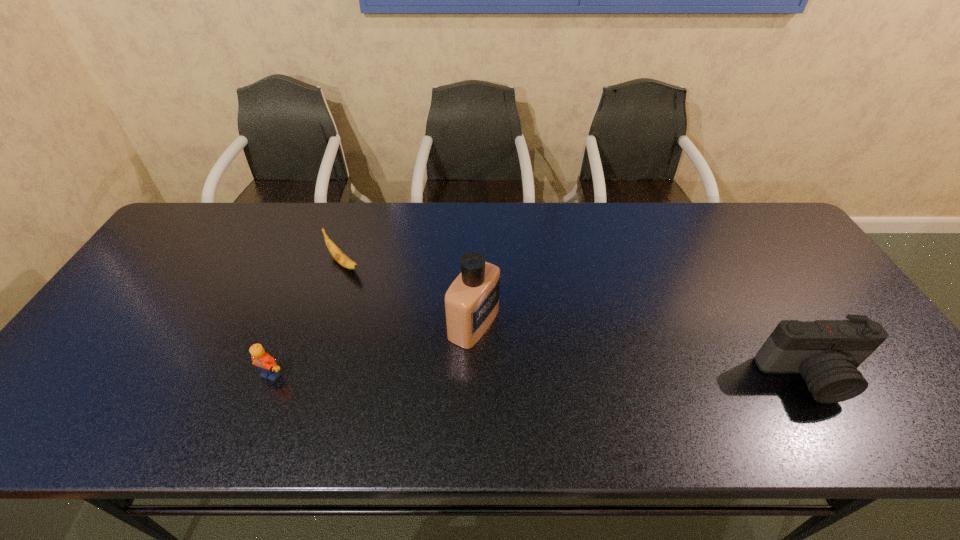
Locate an element on the screen. vacant space at the right edge of the desktop is located at coordinates (782, 275).

You are a GUI agent. You are given a task and a screenshot of the screen. Output one action in this format:
    pyautogui.click(x=<x>, y=<y>)
    Task: Click on the free point at the far left corner
    The height and width of the screenshot is (540, 960).
    Given the screenshot: What is the action you would take?
    pyautogui.click(x=196, y=238)

You are a GUI agent. You are given a task and a screenshot of the screen. Output one action in this format:
    pyautogui.click(x=<x>, y=<y>)
    Task: Click on the free space at the near left corner of the desktop
    This screenshot has width=960, height=540.
    Given the screenshot: What is the action you would take?
    pyautogui.click(x=82, y=386)

This screenshot has height=540, width=960. Identify the location of free point at the far right corner. (744, 221).

Find the location of `free area in between the perfume and the Lego`. free area in between the perfume and the Lego is located at coordinates (372, 349).

At what (x,y) coordinates should I click in order to perform the action: click on free point between the Lego and the camera. Please return your answer as a coordinate pair (x, y). This screenshot has height=540, width=960. Looking at the image, I should click on (540, 376).

Locate an element on the screen. free spot between the banana and the camera is located at coordinates (577, 320).

In order to click on free space between the second tallest object and the third nearest object in this screenshot , I will do `click(642, 350)`.

The image size is (960, 540). What are the coordinates of `vacant space that is in between the farthest object and the third tallest object` in the screenshot? It's located at (307, 319).

At what (x,y) coordinates should I click in order to perform the action: click on unoccupied position between the Lego and the rightmost object. Please return your answer as a coordinate pair (x, y). The height and width of the screenshot is (540, 960). Looking at the image, I should click on (540, 376).